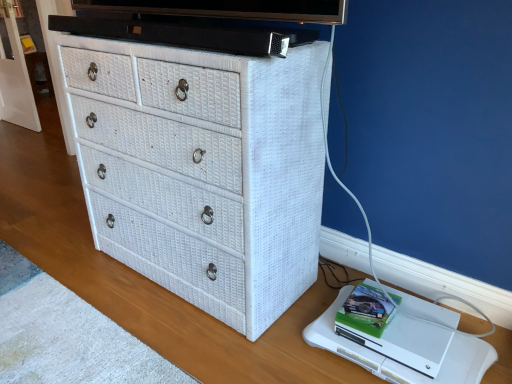
Identify the location of empty space that is ontop of white matte xbox one at lower right. (400, 318).